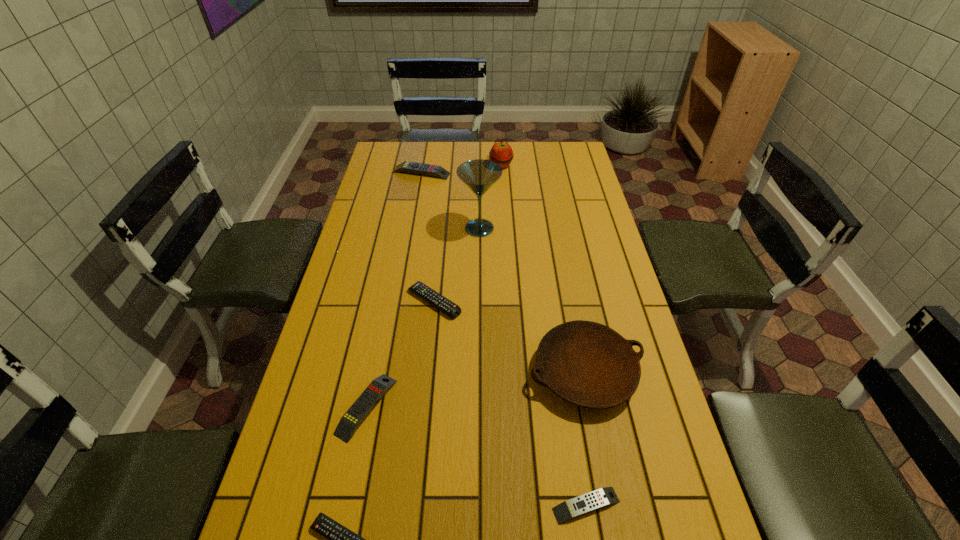
At what (x,y) coordinates should I click in order to perform the action: click on the fifth nearest object. Please return your answer as a coordinate pair (x, y). Looking at the image, I should click on (451, 309).

What are the coordinates of `the smallest yellow remote control` in the screenshot? It's located at (600, 498).

Where is `the rightmost remote control`? The image size is (960, 540). the rightmost remote control is located at coordinates tap(600, 498).

Where is `free space located 0.240m on the back of the martini`? The image size is (960, 540). free space located 0.240m on the back of the martini is located at coordinates (480, 180).

At what (x,y) coordinates should I click in order to perform the action: click on free space located on the front of the second tallest object. Please return your answer as a coordinate pair (x, y). Looking at the image, I should click on (502, 187).

Image resolution: width=960 pixels, height=540 pixels. I want to click on vacant area situated 0.260m on the back of the sixth shortest object, so click(564, 269).

Image resolution: width=960 pixels, height=540 pixels. What are the coordinates of `free space located 0.050m on the right of the biggest yellow remote control` in the screenshot? It's located at (463, 173).

At what (x,y) coordinates should I click in order to perform the action: click on vacant space located on the back of the fourth shortest object. Please return your answer as a coordinate pair (x, y). Looking at the image, I should click on (393, 277).

This screenshot has width=960, height=540. I want to click on vacant region located on the front of the fourth farthest object, so click(x=428, y=361).

Where is `blank space located 0.100m on the left of the smallest yellow remote control`? Image resolution: width=960 pixels, height=540 pixels. blank space located 0.100m on the left of the smallest yellow remote control is located at coordinates [x=504, y=505].